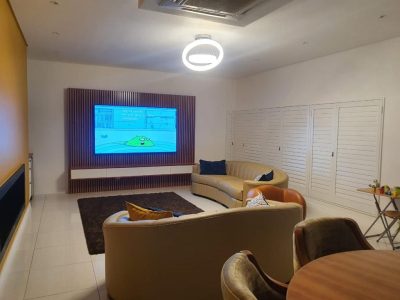
This screenshot has height=300, width=400. Find the location of `ceiling`. ceiling is located at coordinates (298, 29).